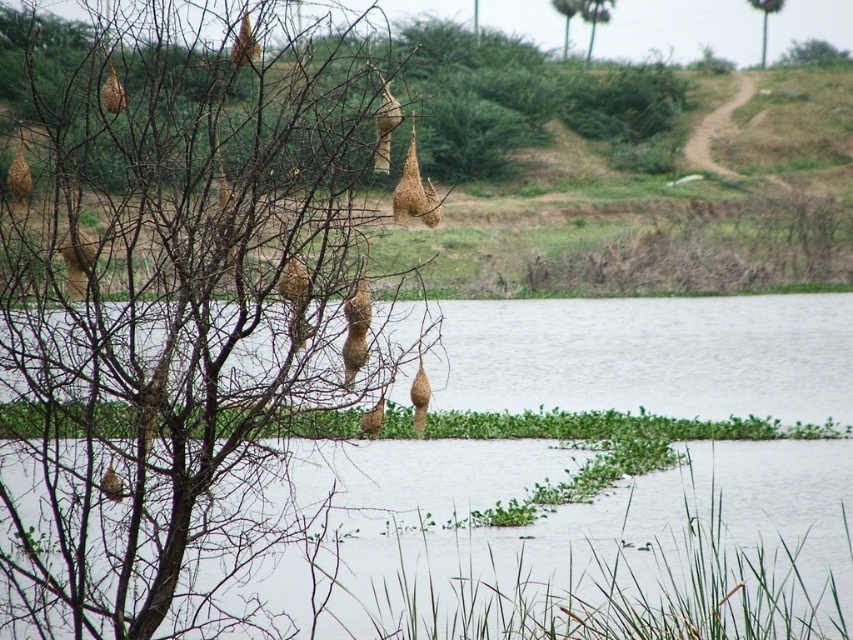
Does brown woven nest at upper center appear under green leafy tree at upper right?

No, brown woven nest at upper center is not below green leafy tree at upper right.

Does brown woven nest at upper center have a smaller size compared to green leafy tree at upper right?

Yes.

This screenshot has height=640, width=853. What do you see at coordinates (595, 17) in the screenshot?
I see `brown woven nest at upper center` at bounding box center [595, 17].

I want to click on brown woven nest at upper center, so click(x=595, y=17).

Is brown woven nest at left behind green leafy tree at upper center?

No, it is in front of green leafy tree at upper center.

Measure the distance between point [282,380] and camera.

Point [282,380] and camera are 7.87 meters apart from each other.

Locate an element on the screen. brown woven nest at left is located at coordinates (173, 312).

Which is below, brown woven nest at upper center or green leafy tree at upper center?

Positioned lower is brown woven nest at upper center.

Is point (602, 12) positioned after point (566, 54)?

Yes, it is.

Find the location of a particular element. The height and width of the screenshot is (640, 853). brown woven nest at upper center is located at coordinates (595, 17).